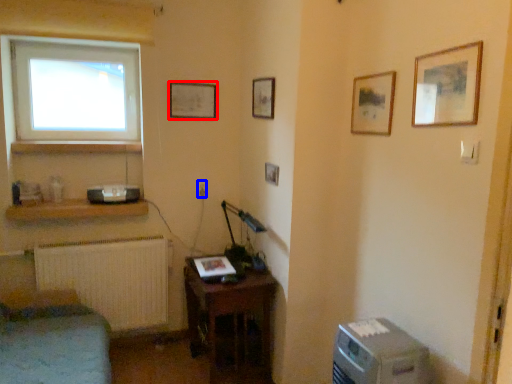
Question: Which of the following is the farthest to the observer, picture frame (highlighted by a red box) or electric outlet (highlighted by a blue box)?

Choices:
 (A) picture frame
 (B) electric outlet

Answer: (B)